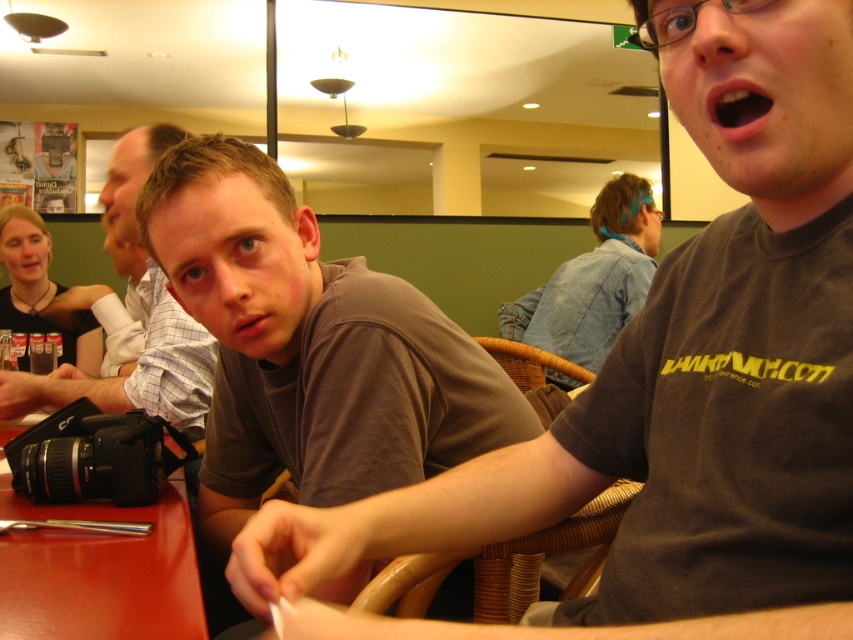
Who is positioned more to the left, brown cotton shirt at center or red plastic table at lower left?

Positioned to the left is red plastic table at lower left.

Who is higher up, brown cotton shirt at center or red plastic table at lower left?

brown cotton shirt at center

Between point (738, 234) and point (49, 620), which one is positioned behind?

Positioned behind is point (49, 620).

Where is `brown cotton shirt at center`? The image size is (853, 640). brown cotton shirt at center is located at coordinates (671, 390).

Where is `matte gray shirt at center`? This screenshot has height=640, width=853. matte gray shirt at center is located at coordinates (134, 371).

Does matte gray shirt at center appear under denim jacket at upper center?

Correct, matte gray shirt at center is located below denim jacket at upper center.

Does point (132, 384) lie behind point (544, 333)?

No, it is in front of (544, 333).

You are a GUI agent. You are given a task and a screenshot of the screen. Output one action in this format:
    pyautogui.click(x=<x>, y=<y>)
    Task: Click on the matte gray shirt at center
    This screenshot has width=853, height=640.
    Given the screenshot: What is the action you would take?
    pyautogui.click(x=134, y=371)

Can you confirm if brown cotton shirt at center is shorter than pink matte lips at center?

No.

Who is lower down, brown cotton shirt at center or pink matte lips at center?

brown cotton shirt at center

The height and width of the screenshot is (640, 853). I want to click on brown cotton shirt at center, so click(671, 390).